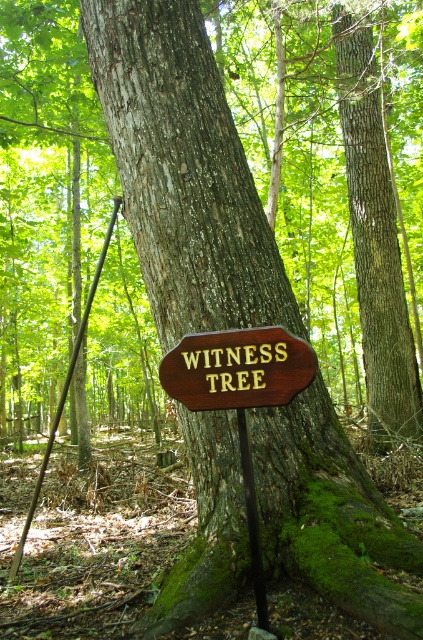
Looking at this image, you are a hiker who wants to take a photo of the wooden sign at center and the brushed metal pole at left. From your current position, which object should you look down at to capture both in the frame?

The wooden sign at center is below the brushed metal pole at left, so you should look down at the wooden sign at center to include both in the frame since it is positioned lower than the brushed metal pole at left.

From the picture: You are standing in front of the large tree trunk in the forest scene. There are two points marked on the trunk at coordinates point (x=371, y=168) and point (x=258, y=403). Which point is closer to your eyes?

Point (x=258, y=403) is closer to your eyes because it is less further to the camera than point (x=371, y=168).

You are a park ranger assessing the health of the forest. You notice the brown rough bark tree trunk at center and the black metal pole at center. Which object is wider in diameter?

The brown rough bark tree trunk at center is wider in diameter than the black metal pole at center.